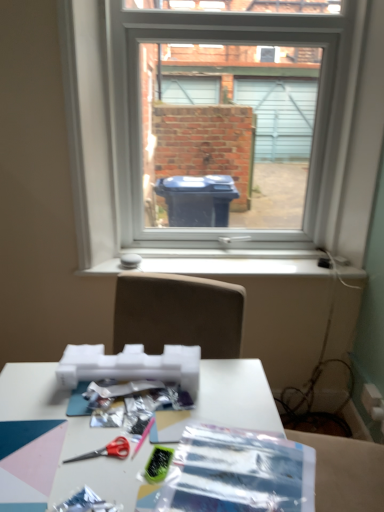
Identify the location of empty space that is to the right of red plastic scissors at lower center. The width and height of the screenshot is (384, 512). click(x=170, y=459).